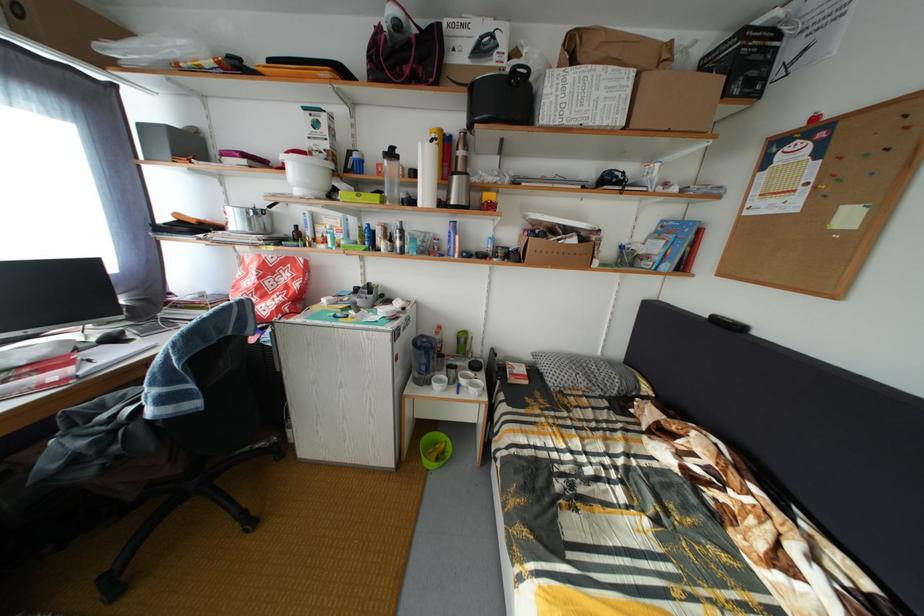
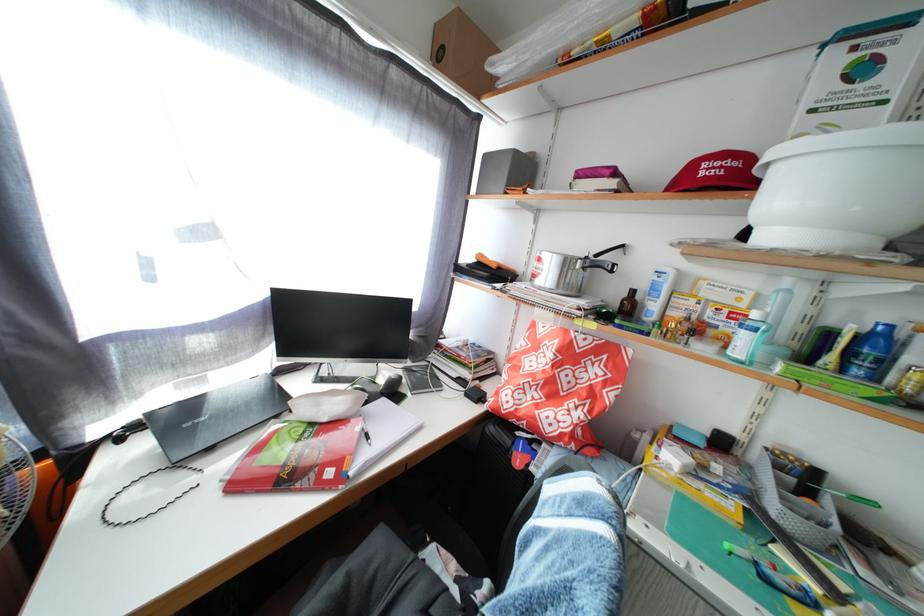
Where in the second image is the point corresponding to [375,249] from the first image?

(866, 378)